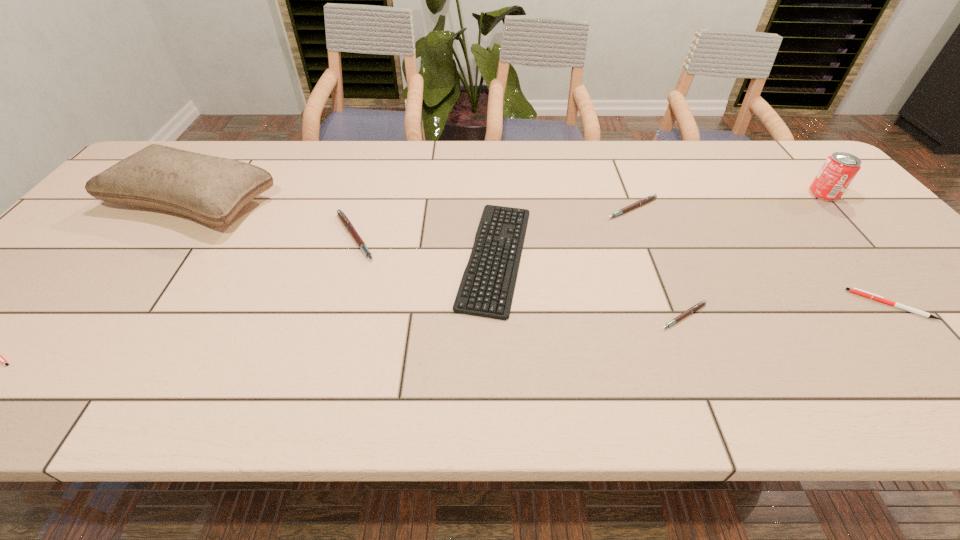
Identify the location of blank region between the tallest object and the farther white pen. 542,254.

You are a GUI agent. You are given a task and a screenshot of the screen. Output one action in this format:
    pyautogui.click(x=<x>, y=<y>)
    Task: Click on the empty space between the fifth object from right to left and the fourth shortest pen
    
    Given the screenshot: What is the action you would take?
    pyautogui.click(x=564, y=232)

Identify the location of free space between the can and the taupe cushion. (509, 199).

This screenshot has height=540, width=960. Identify the location of unoccupied area between the computer keyboard and the smallest pink pen. (589, 286).

Locate an element on the screen. This screenshot has height=540, width=960. vacant space in between the computer keyboard and the tallest object is located at coordinates (345, 230).

Where is `free space between the tallest object and the fifth object from right to left`? The height and width of the screenshot is (540, 960). free space between the tallest object and the fifth object from right to left is located at coordinates (345, 230).

In order to click on object that ranks as the second closest to the tallest object in this screenshot , I will do `click(0, 359)`.

Find the location of a particular element. The width and height of the screenshot is (960, 540). object that ranks as the third closest to the computer keyboard is located at coordinates (694, 308).

Locate an element on the screen. Image resolution: width=960 pixels, height=540 pixels. pen that is the second closest one to the cushion is located at coordinates (0, 359).

Identify which pen is the fifth nearest to the taupe cushion. Please provide its 2D coordinates. Your answer should be formatted as a tuple, i.e. [(x, y)], where the tuple contains the x and y coordinates of a point satisfying the conditions above.

[(854, 290)]